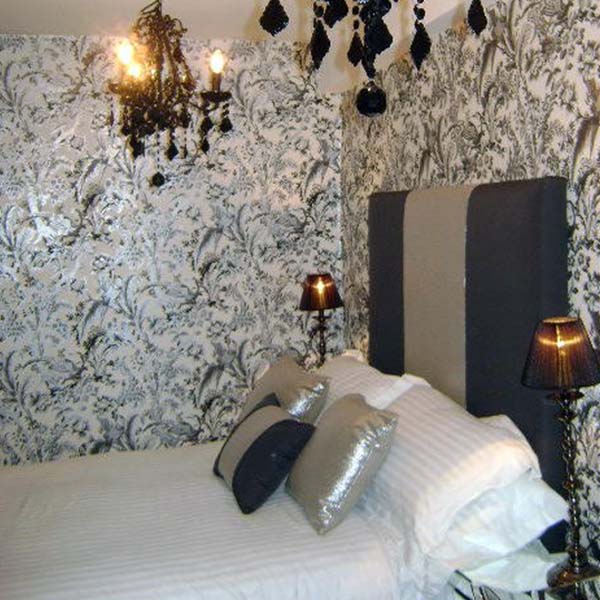
Where is `light`? light is located at coordinates (134, 67).